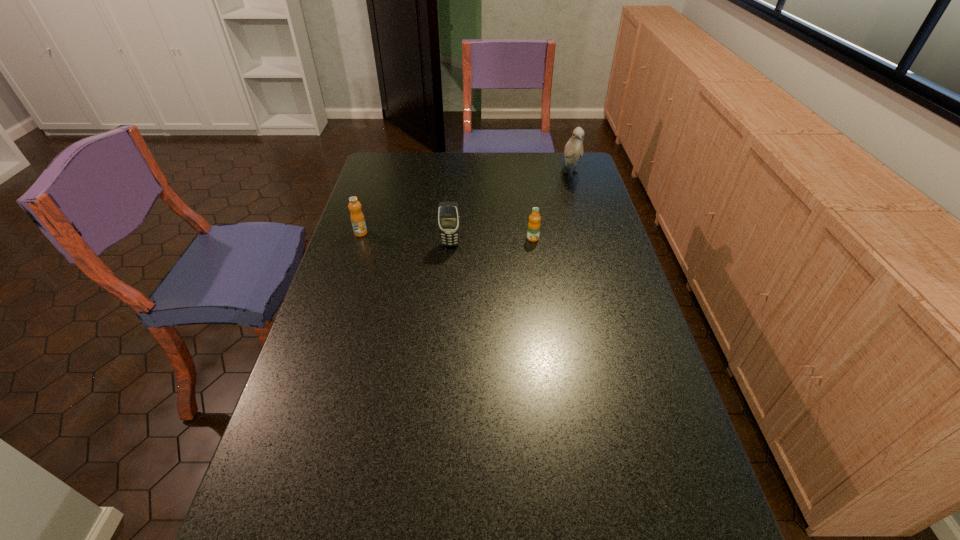
At what (x,y) coordinates should I click in order to perform the action: click on the rightmost object. Please return your answer as a coordinate pair (x, y). Looking at the image, I should click on (573, 151).

This screenshot has width=960, height=540. What are the coordinates of `the tallest object` in the screenshot? It's located at (573, 151).

Image resolution: width=960 pixels, height=540 pixels. In order to click on cellular telephone in this screenshot , I will do `click(448, 212)`.

Find the location of `the second tallest object`. the second tallest object is located at coordinates (448, 212).

At what (x,y) coordinates should I click in order to perform the action: click on the leftmost object. Please return your answer as a coordinate pair (x, y). Looking at the image, I should click on (357, 218).

Locate an element on the screen. This screenshot has width=960, height=540. the shorter orange juice is located at coordinates (533, 232).

Where is `the right orange juice`? The width and height of the screenshot is (960, 540). the right orange juice is located at coordinates (533, 232).

Image resolution: width=960 pixels, height=540 pixels. Identify the location of free location located 0.330m at the beak of the farthest object. point(588,235).

At what (x,y) coordinates should I click in order to perform the action: click on free region located 0.370m on the front face of the third shortest object. Please return your answer as a coordinate pair (x, y). Looking at the image, I should click on point(444,333).

Where is `vacant space located 0.090m on the front label of the left orange juice`? vacant space located 0.090m on the front label of the left orange juice is located at coordinates (354, 254).